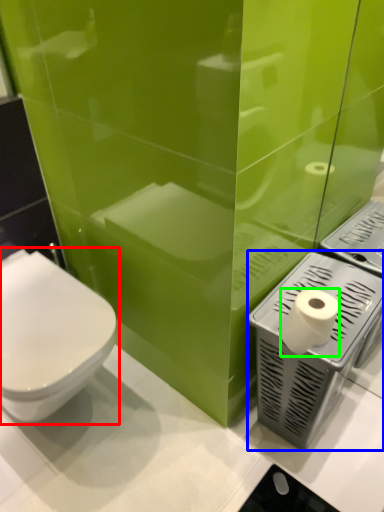
Question: Which object is the closest to the toilet (highlighted by a red box)? Choose among these: appliance (highlighted by a blue box) or toilet paper (highlighted by a green box).

Choices:
 (A) appliance
 (B) toilet paper

Answer: (A)